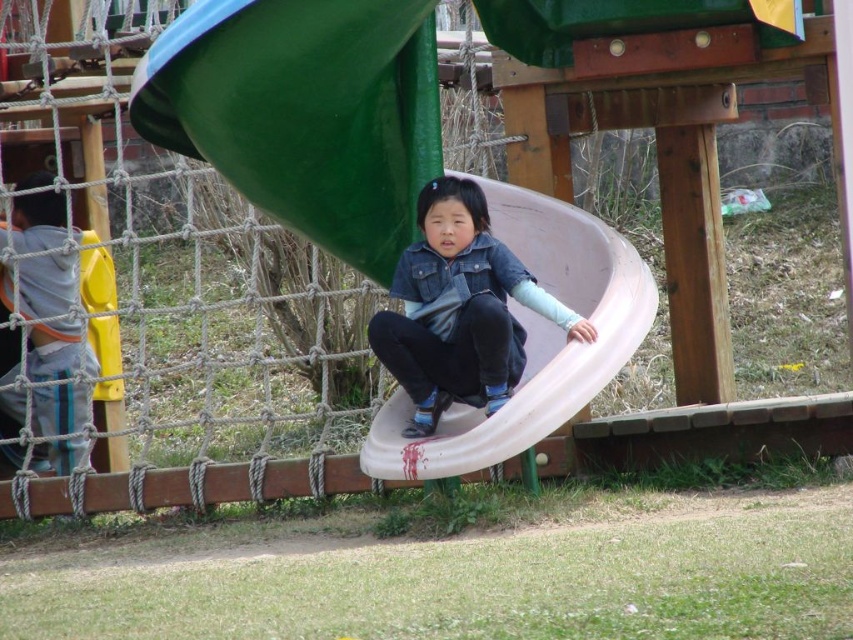
Question: From the image, what is the correct spatial relationship of white plastic slide at center in relation to matte blue slide at center?

Choices:
 (A) right
 (B) left

Answer: (A)

Question: Which point is closer to the camera taking this photo?

Choices:
 (A) (552, 371)
 (B) (39, 202)
 (C) (408, 353)

Answer: (A)

Question: Can you confirm if matte blue slide at center is bigger than gray hoodie at left?

Choices:
 (A) yes
 (B) no

Answer: (B)

Question: Which object is farther from the camera taking this photo?

Choices:
 (A) white plastic slide at center
 (B) matte blue slide at center
 (C) gray hoodie at left

Answer: (C)

Question: Among these objects, which one is farthest from the camera?

Choices:
 (A) gray hoodie at left
 (B) matte blue slide at center
 (C) white plastic slide at center

Answer: (A)

Question: Is white plastic slide at center wider than matte blue slide at center?

Choices:
 (A) yes
 (B) no

Answer: (B)